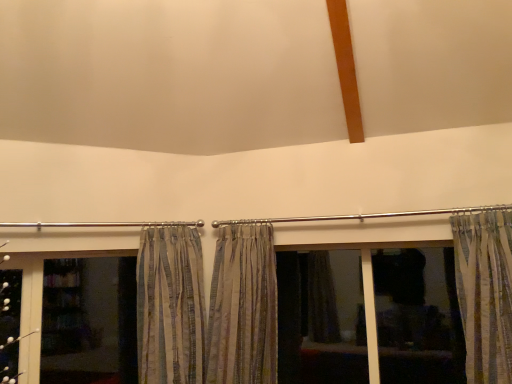
Question: From a real-world perspective, is transparent glass screen door at lower left on striped fabric curtain at center, the second curtain in the left-to-right sequence?

Choices:
 (A) no
 (B) yes

Answer: (A)

Question: Is there a large distance between transparent glass screen door at lower left and striped fabric curtain at center, the second curtain in the left-to-right sequence?

Choices:
 (A) yes
 (B) no

Answer: (A)

Question: Can you confirm if transparent glass screen door at lower left is positioned to the left of striped fabric curtain at center, the second curtain in the left-to-right sequence?

Choices:
 (A) no
 (B) yes

Answer: (B)

Question: Is transparent glass screen door at lower left at the right side of striped fabric curtain at center, the second curtain in the right-to-left sequence?

Choices:
 (A) no
 (B) yes

Answer: (A)

Question: Is the depth of transparent glass screen door at lower left greater than that of striped fabric curtain at center, the second curtain in the left-to-right sequence?

Choices:
 (A) no
 (B) yes

Answer: (B)

Question: Would you say striped fabric curtain at right, the first curtain from the right, is inside or outside striped fabric curtain at center, the second curtain in the left-to-right sequence?

Choices:
 (A) outside
 (B) inside

Answer: (A)

Question: From the image's perspective, is striped fabric curtain at right, which ranks as the third curtain in left-to-right order, above or below striped fabric curtain at center, the second curtain in the right-to-left sequence?

Choices:
 (A) above
 (B) below

Answer: (A)

Question: From a real-world perspective, relative to striped fabric curtain at center, the second curtain in the right-to-left sequence, is striped fabric curtain at right, the first curtain from the right, vertically above or below?

Choices:
 (A) below
 (B) above

Answer: (B)

Question: In the image, is striped fabric curtain at right, the first curtain from the right, positioned in front of or behind striped fabric curtain at center, the second curtain in the left-to-right sequence?

Choices:
 (A) front
 (B) behind

Answer: (A)

Question: From a real-world perspective, is striped fabric curtain at right, the first curtain from the right, positioned above or below dark fabric curtain at center?

Choices:
 (A) below
 (B) above

Answer: (B)

Question: Is point (x=483, y=225) closer or farther from the camera than point (x=280, y=268)?

Choices:
 (A) closer
 (B) farther

Answer: (A)

Question: From their relative heights in the image, would you say striped fabric curtain at right, which ranks as the third curtain in left-to-right order, is taller or shorter than dark fabric curtain at center?

Choices:
 (A) short
 (B) tall

Answer: (A)

Question: Looking at their shapes, would you say striped fabric curtain at right, the first curtain from the right, is wider or thinner than dark fabric curtain at center?

Choices:
 (A) wide
 (B) thin

Answer: (A)

Question: Is point (437, 329) positioned closer to the camera than point (155, 256)?

Choices:
 (A) farther
 (B) closer

Answer: (A)

Question: From their relative heights in the image, would you say dark fabric curtain at center is taller or shorter than striped fabric curtain at center, arranged as the third curtain when viewed from the right?

Choices:
 (A) short
 (B) tall

Answer: (A)